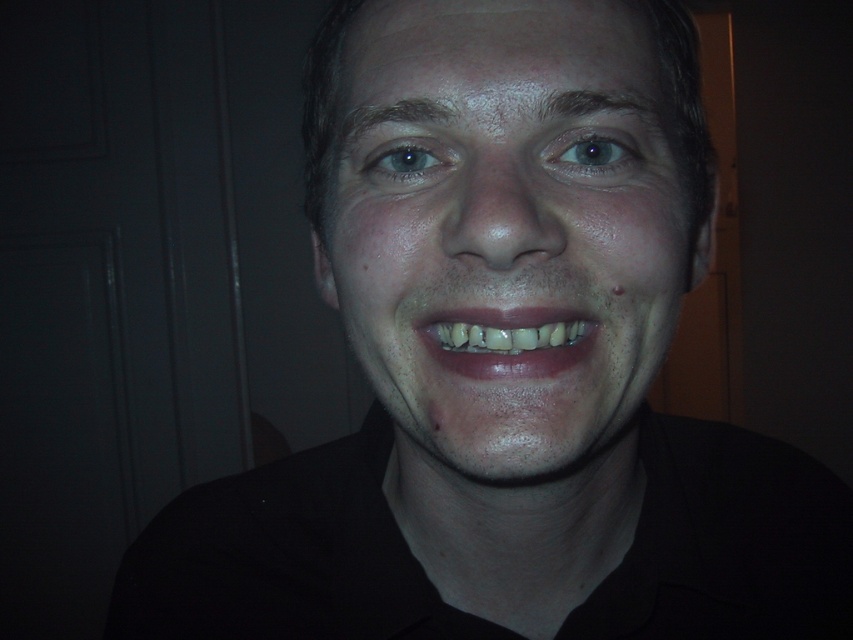
Question: Which object is the farthest from the black matte neck at center?

Choices:
 (A) smooth skin face at center
 (B) natural teeth at center

Answer: (B)

Question: Can you confirm if black matte neck at center is thinner than natural teeth at center?

Choices:
 (A) yes
 (B) no

Answer: (B)

Question: Which point appears farthest from the camera in this image?

Choices:
 (A) (349, 156)
 (B) (496, 355)

Answer: (A)

Question: Is smooth skin face at center thinner than natural teeth at center?

Choices:
 (A) yes
 (B) no

Answer: (B)

Question: Can you confirm if black matte neck at center is positioned to the left of natural teeth at center?

Choices:
 (A) yes
 (B) no

Answer: (A)

Question: Estimate the real-world distances between objects in this image. Which object is closer to the natural teeth at center?

Choices:
 (A) black matte neck at center
 (B) smooth skin face at center

Answer: (B)